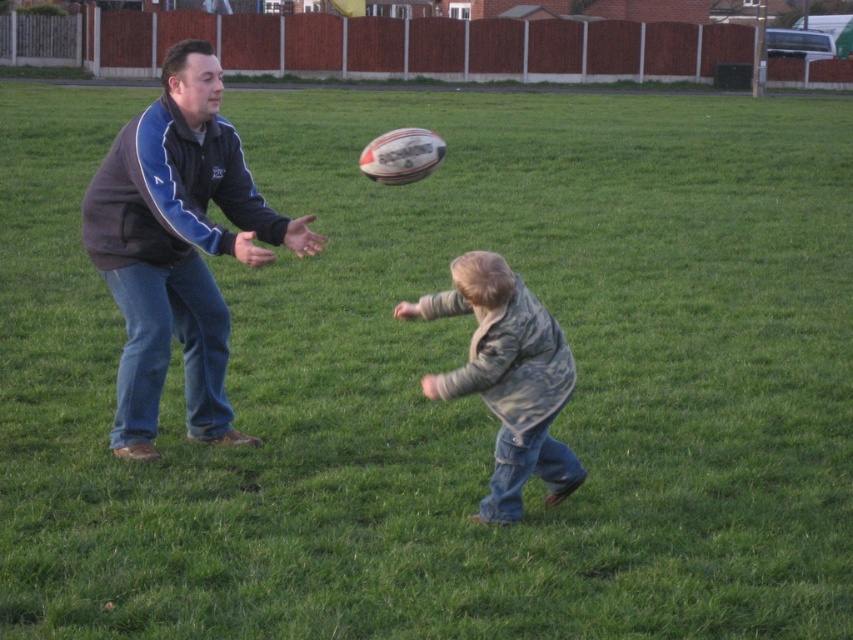
Question: Does dark blue fleece jacket at left have a greater width compared to denim jacket at lower center?

Choices:
 (A) yes
 (B) no

Answer: (A)

Question: Is dark blue fleece jacket at left thinner than denim jacket at lower center?

Choices:
 (A) no
 (B) yes

Answer: (A)

Question: Is the position of dark blue fleece jacket at left less distant than that of denim jacket at lower center?

Choices:
 (A) yes
 (B) no

Answer: (B)

Question: Which object is closer to the camera taking this photo?

Choices:
 (A) dark blue fleece jacket at left
 (B) denim jacket at lower center

Answer: (B)

Question: Among these points, which one is nearest to the camera?

Choices:
 (A) (498, 477)
 (B) (238, 212)

Answer: (A)